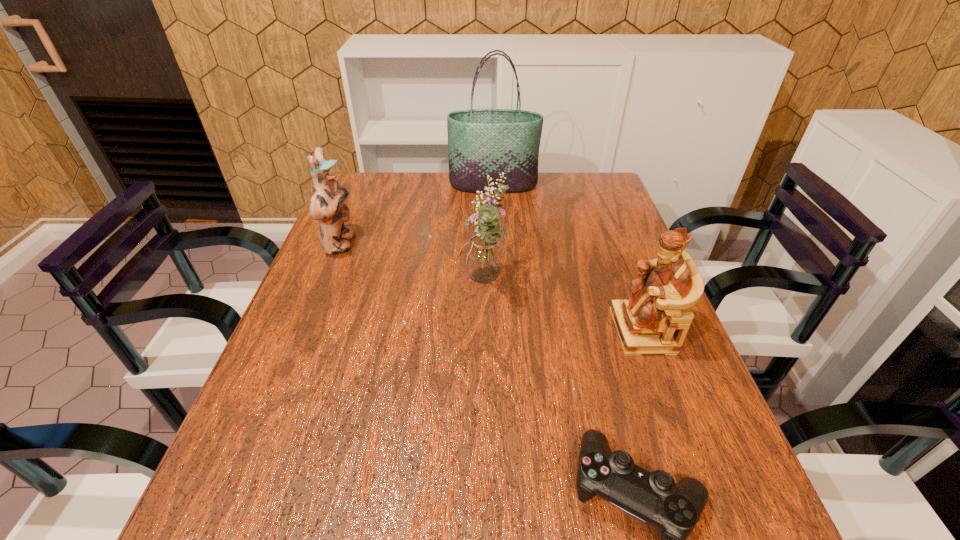
You are a GUI agent. You are given a task and a screenshot of the screen. Output one action in this format:
    pyautogui.click(x=<x>, y=<y>)
    Task: Click on the vacant space that satisfies the following two spatial constraints: 1. on the front side of the tallest object; 2. on the front-facing side of the bouquet
    Image resolution: width=960 pixels, height=540 pixels.
    Given the screenshot: What is the action you would take?
    pyautogui.click(x=498, y=285)